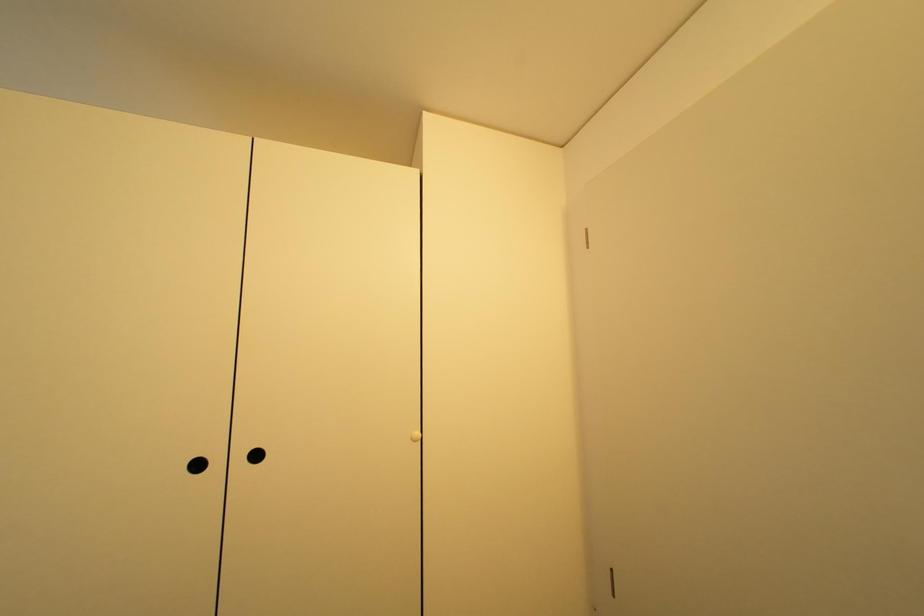
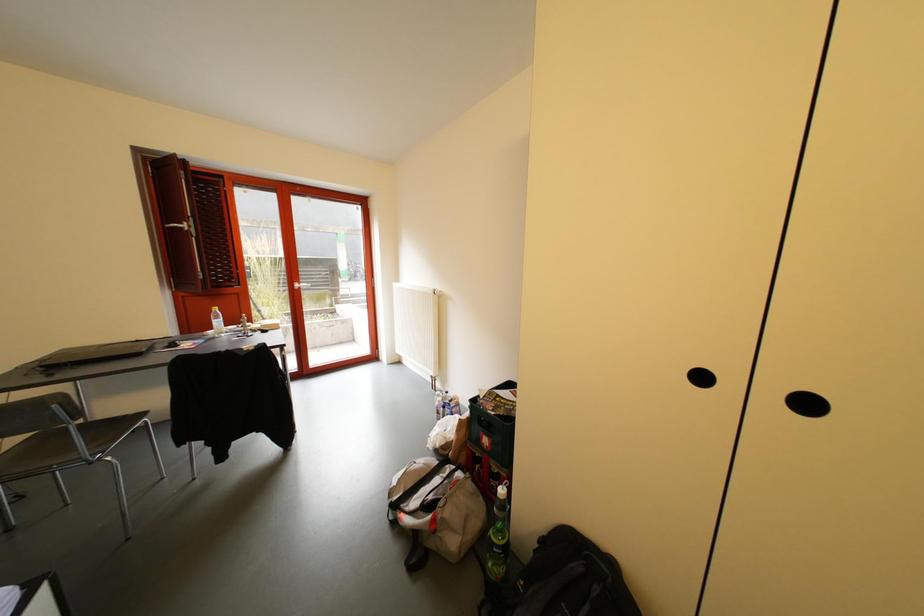
Question: Based on the continuous images, in which direction is the camera rotating? Reply with the corresponding letter.

Choices:
 (A) Left
 (B) Right
 (C) Up
 (D) Down

Answer: (A)